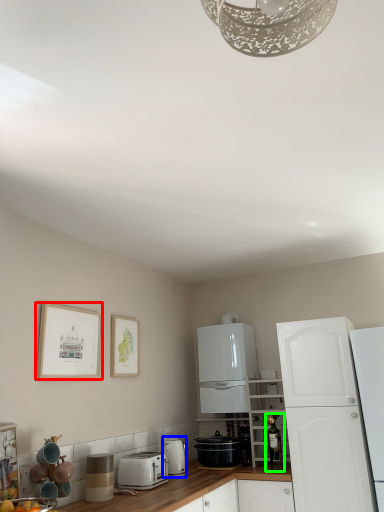
Question: Which object is positioned closest to picture frame (highlighted by a red box)? Select from kitchen appliance (highlighted by a blue box) and appliance (highlighted by a green box).

Choices:
 (A) kitchen appliance
 (B) appliance

Answer: (A)